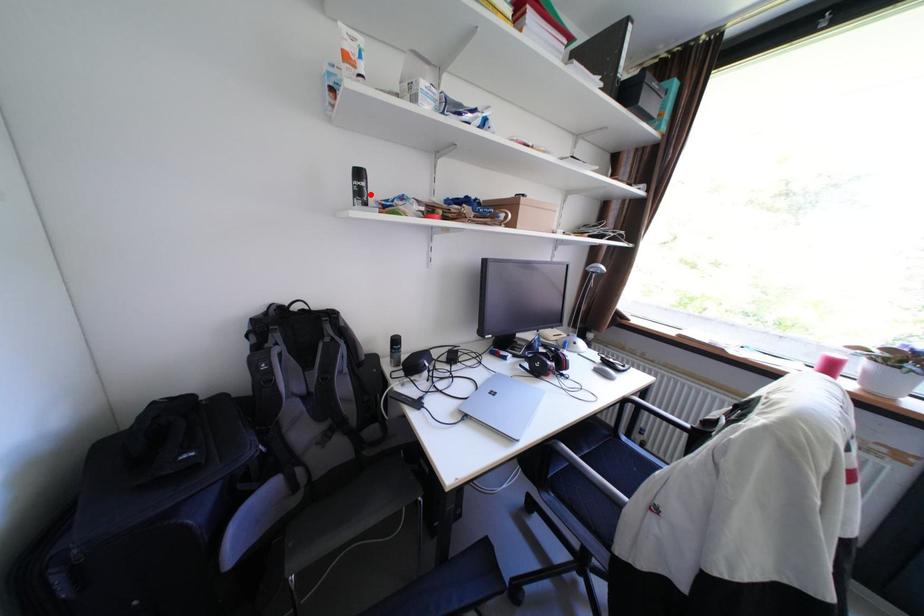
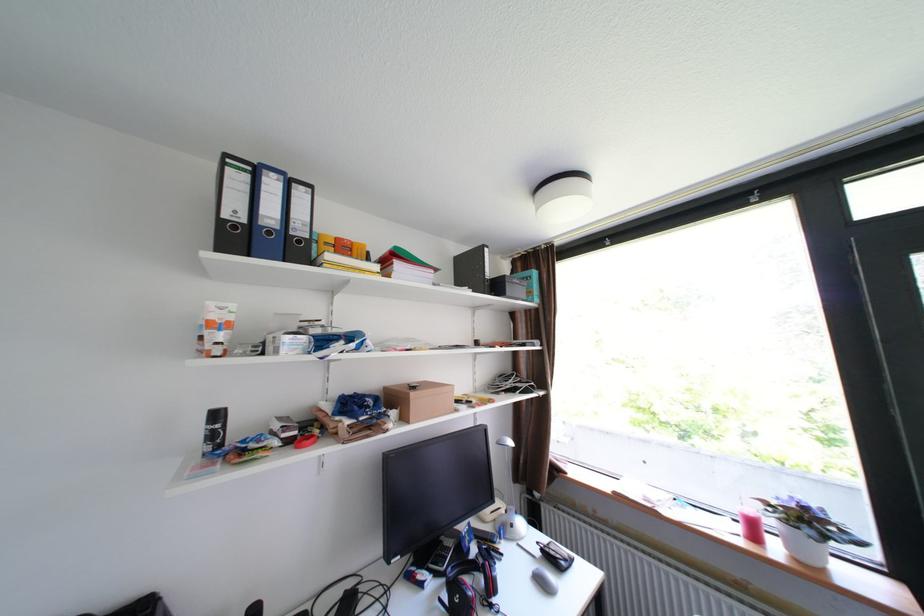
In the second image, find the point that corresponds to the highlighted location in the first image.

(225, 436)